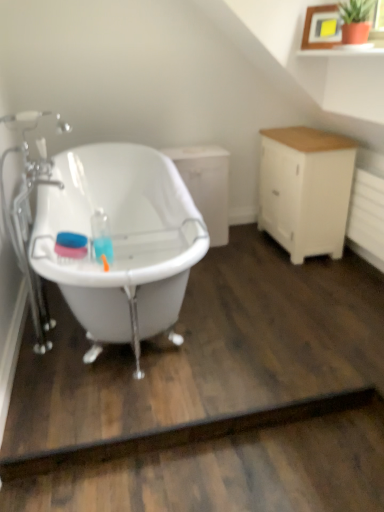
Where is `free space to the left of white wood cabinet at right, the first cabinetry viewed from the right`? free space to the left of white wood cabinet at right, the first cabinetry viewed from the right is located at coordinates (243, 254).